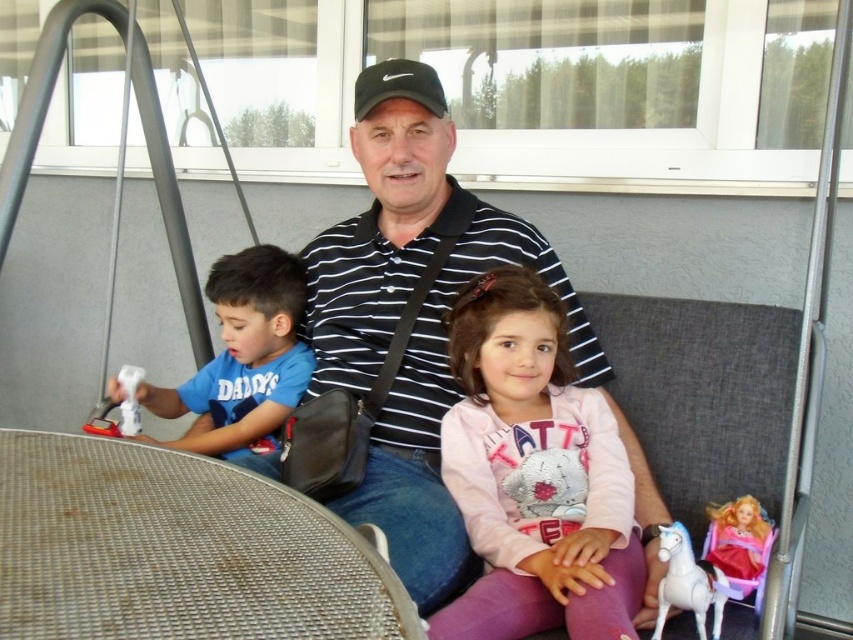
You are a child who wants to play with the white plastic horse at lower right and the shiny plastic doll at lower right. Which one is closer to you if you are standing in front of the table?

The white plastic horse at lower right is closer to you because it is positioned under the shiny plastic doll at lower right, meaning it is lower and nearer in the arrangement.

From the picture: You are trying to decide which item to grab first from the scene described. The pink fleece jacket at center and the black matte baseball cap at center are both within reach. Based on their sizes, which one do you think is easier to pick up?

The black matte baseball cap at center is easier to pick up because it is shorter than the pink fleece jacket at center, making it more accessible.